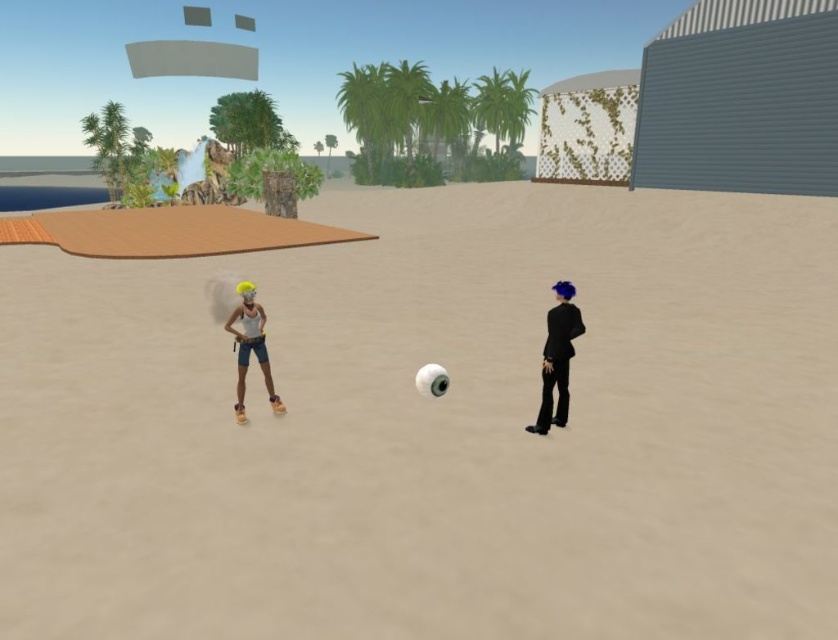
Is point (546, 332) in front of point (242, 417)?

No, (546, 332) is behind (242, 417).

Which of these two, shiny black suit at right or matte yellow hair at center, stands taller?

Standing taller between the two is shiny black suit at right.

Which is in front, point (552, 356) or point (242, 326)?

Point (552, 356)

Locate an element on the screen. shiny black suit at right is located at coordinates (557, 356).

Who is shorter, beige sand at center or shiny black suit at right?

shiny black suit at right is shorter.

Based on the photo, can you confirm if beige sand at center is positioned to the right of shiny black suit at right?

Yes, beige sand at center is to the right of shiny black suit at right.

Between point (149, 296) and point (567, 289), which one is positioned behind?

The point (149, 296) is more distant.

Find the location of `beige sand at center`. beige sand at center is located at coordinates (433, 428).

Between beige sand at center and matte yellow hair at center, which one appears on the left side from the viewer's perspective?

From the viewer's perspective, matte yellow hair at center appears more on the left side.

Based on the photo, can you confirm if beige sand at center is bigger than matte yellow hair at center?

Yes.

Between point (588, 604) and point (261, 353), which one is positioned behind?

Point (261, 353)

The height and width of the screenshot is (640, 838). In order to click on beige sand at center in this screenshot , I will do `click(433, 428)`.